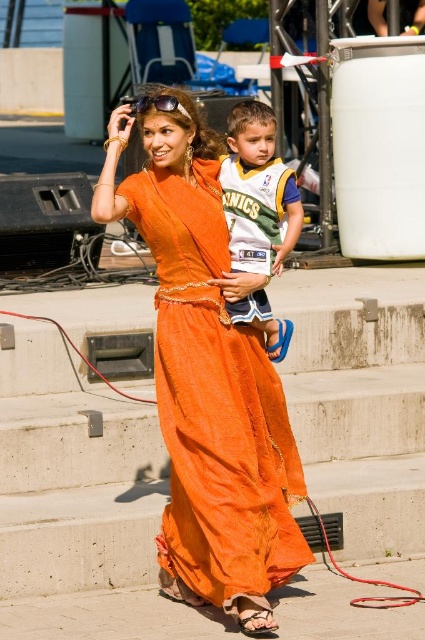
From the picture: Does orange silk dress at center have a larger size compared to white jersey at center?

No, orange silk dress at center is not bigger than white jersey at center.

Is point (210, 326) closer to camera compared to point (268, 316)?

Yes, point (210, 326) is in front of point (268, 316).

Consider the image. Measure the distance between orange silk dress at center and camera.

10.20 meters

Identify the location of orange silk dress at center. (207, 374).